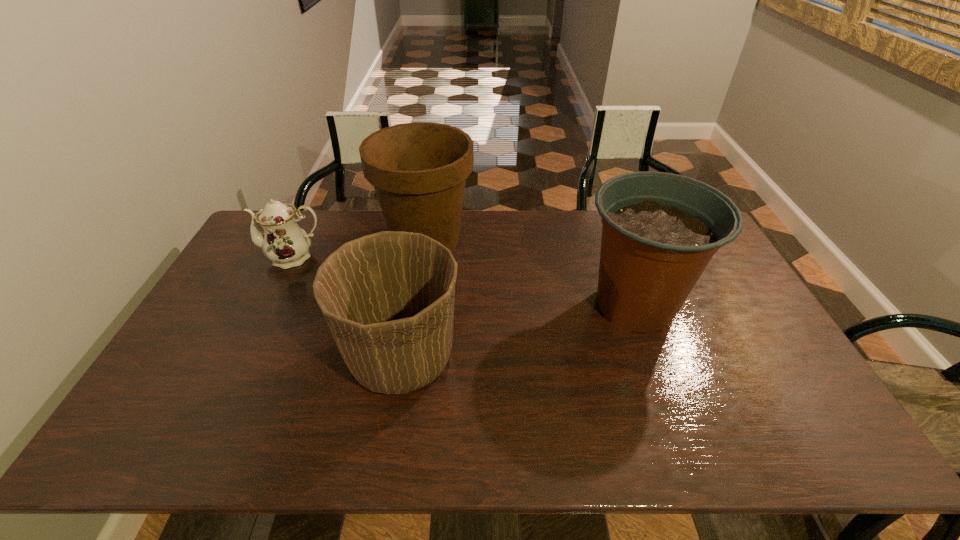
Find the location of a particular element. vacant region at the left edge is located at coordinates (199, 374).

In the image, there is a desktop. At what (x,y) coordinates should I click in order to perform the action: click on vacant space at the right edge. Please return your answer as a coordinate pair (x, y). The width and height of the screenshot is (960, 540). Looking at the image, I should click on (800, 382).

Find the location of a particular element. The image size is (960, 540). unoccupied area between the rightmost flowerpot and the shortest object is located at coordinates (465, 282).

Where is `empty location between the chinaware and the rightmost object`? This screenshot has width=960, height=540. empty location between the chinaware and the rightmost object is located at coordinates (465, 282).

Image resolution: width=960 pixels, height=540 pixels. Find the location of `free space between the rightmost object and the chinaware`. free space between the rightmost object and the chinaware is located at coordinates (465, 282).

What are the coordinates of `vacant area that lies between the rightmost flowerpot and the chinaware` in the screenshot? It's located at (465, 282).

Select which object is the third closest to the rightmost object. Please provide its 2D coordinates. Your answer should be formatted as a tuple, i.e. [(x, y)], where the tuple contains the x and y coordinates of a point satisfying the conditions above.

[(284, 242)]

Identify which object is the nearest to the shortest object. Please provide its 2D coordinates. Your answer should be formatted as a tuple, i.e. [(x, y)], where the tuple contains the x and y coordinates of a point satisfying the conditions above.

[(419, 170)]

The width and height of the screenshot is (960, 540). What are the coordinates of `flowerpot that is the closest to the leftmost object` in the screenshot? It's located at (419, 170).

Locate which flowerpot is the second closest to the rightmost flowerpot. Please provide its 2D coordinates. Your answer should be formatted as a tuple, i.e. [(x, y)], where the tuple contains the x and y coordinates of a point satisfying the conditions above.

[(388, 298)]